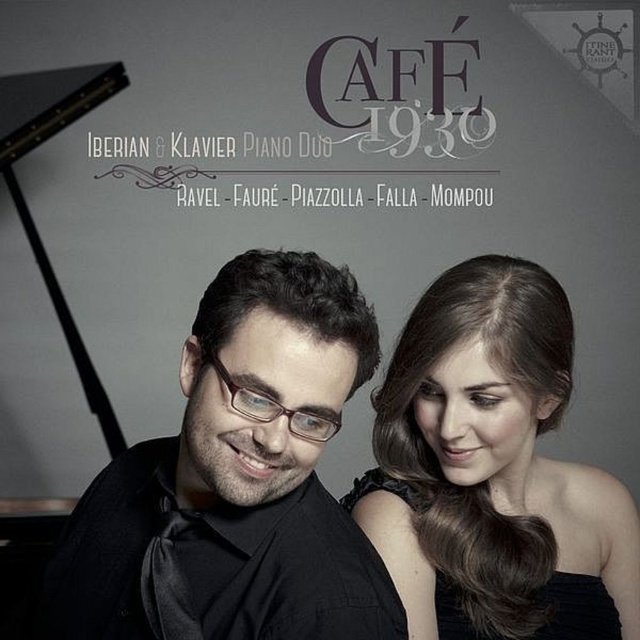
You are a photographer trying to capture the brown hair at upper right in the image. The camera is set to focus on the point at coordinates point (493, 470). Will this point be sufficient to ensure the brown hair at upper right is in focus?

Yes, the point (493, 470) corresponds to the brown hair at upper right, so focusing on this point will ensure the brown hair at upper right is in focus.